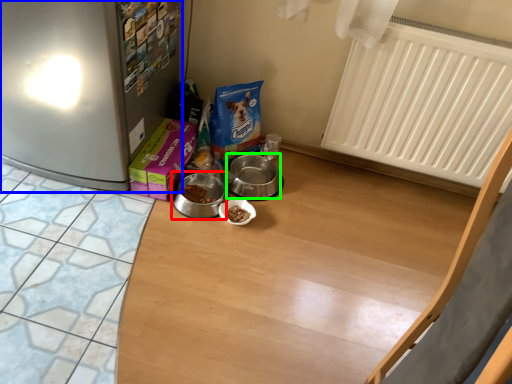
Question: Considering the real-world distances, which object is closest to appliance (highlighted by a red box)? fridge (highlighted by a blue box) or appliance (highlighted by a green box).

Choices:
 (A) fridge
 (B) appliance

Answer: (B)